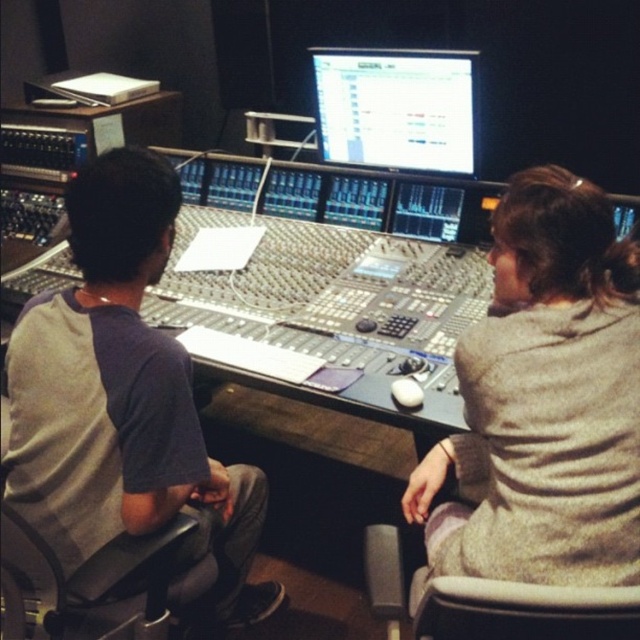
You are a technician in the studio who needs to place a camera to film the person wearing the gray wool sweater at right. The camera requires a minimum of 3 feet of space to avoid obstruction. Can the camera be placed as needed?

The gray wool sweater at right and camera are 3.33 feet apart, so yes, the camera can be placed as needed since the distance is more than the required 3 feet.